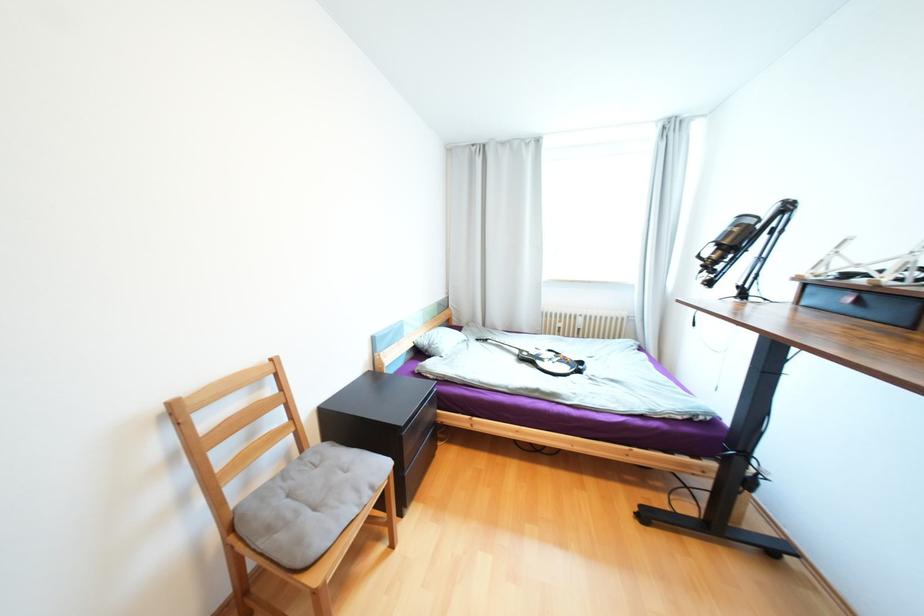
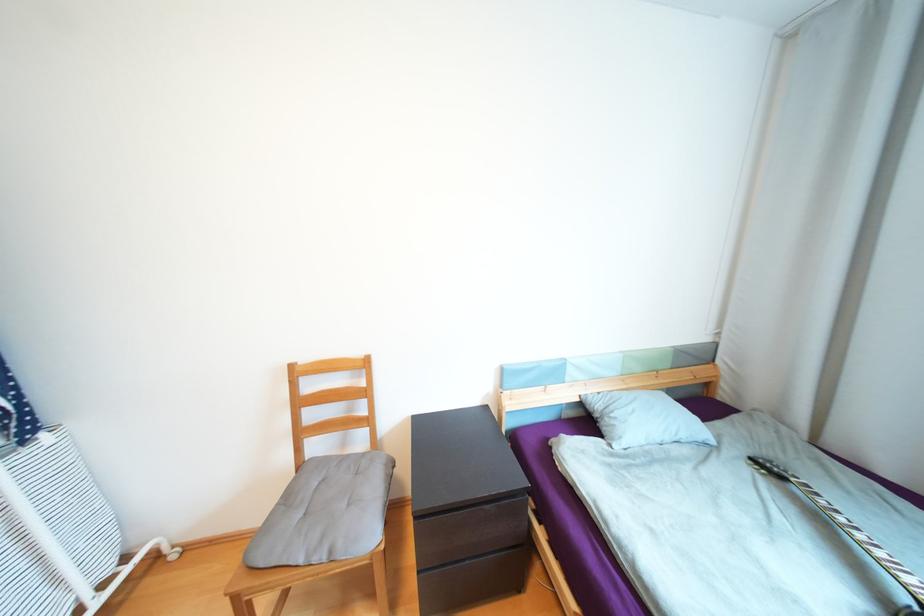
In the second image, find the point that corresponds to (419,339) in the first image.

(588, 392)